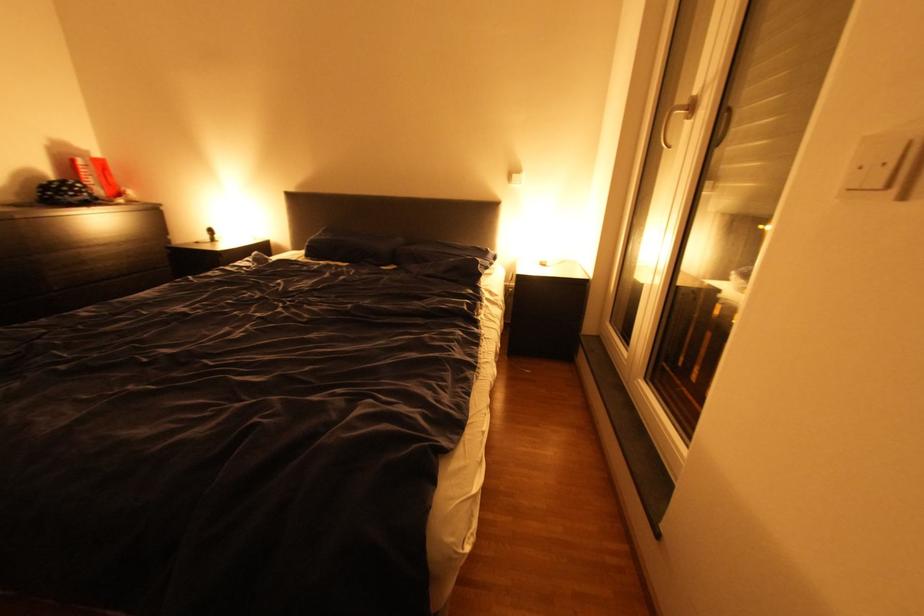
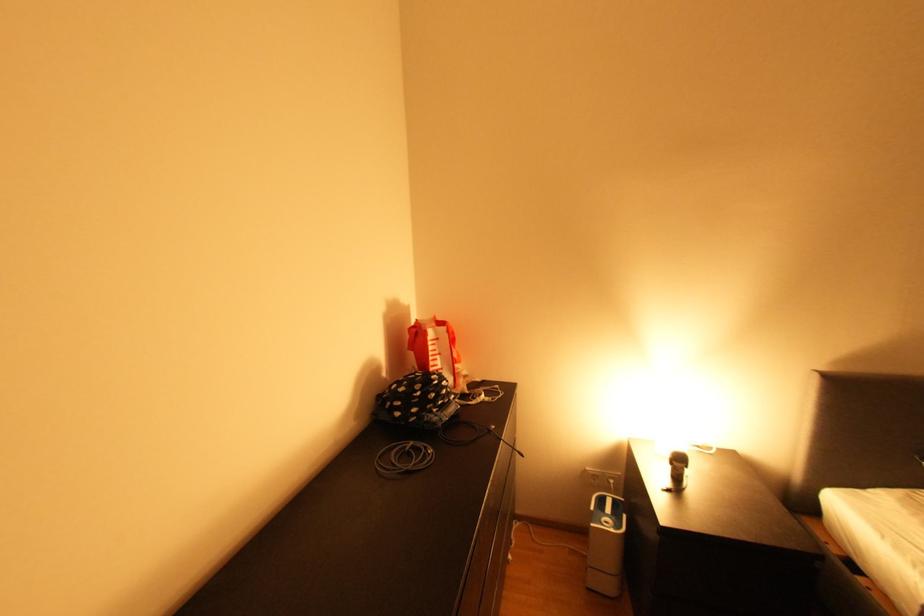
In the second image, find the point that corresponds to pixel 71 196 in the first image.

(441, 411)